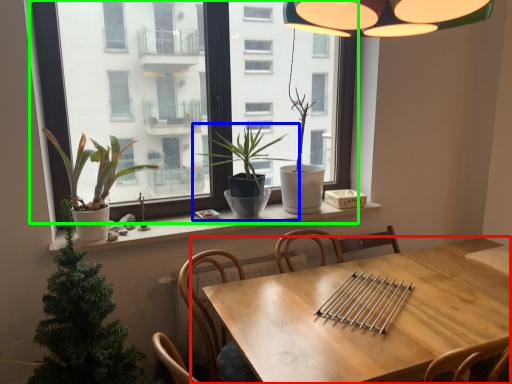
Question: Based on their relative distances, which object is nearer to table (highlighted by a red box)? Choose from houseplant (highlighted by a blue box) and window (highlighted by a green box).

Choices:
 (A) houseplant
 (B) window

Answer: (A)